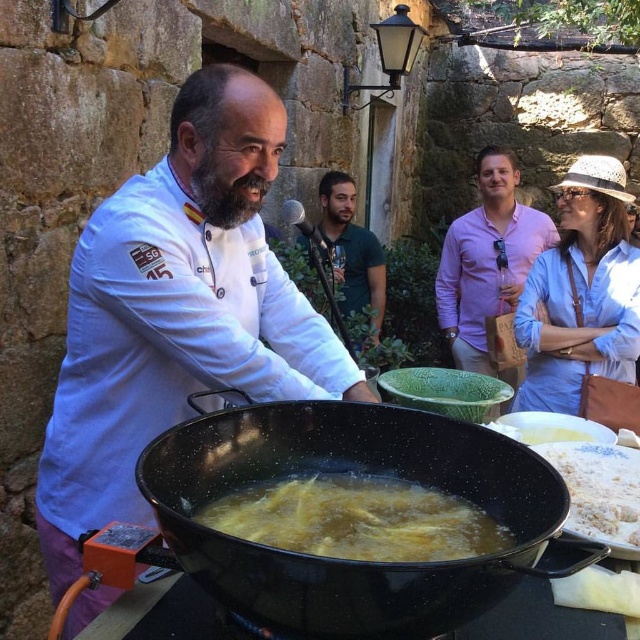
You are a photographer positioned at the front of the demonstration area. You need to take a photo that includes both the pink cotton shirt at upper center and the white flour at lower right. Which object will appear closer to the camera in the photo?

The pink cotton shirt at upper center will appear closer to the camera in the photo because it is further to the viewer than the white flour at lower right.

You are a photographer at the cooking event and need to capture both the pink cotton shirt at upper center and the white flour at lower right in a single shot. Given that your camera has a fixed focal length, which object should you focus on first to ensure both are in frame?

The pink cotton shirt at upper center is larger in size than the white flour at lower right, so focusing on the pink cotton shirt at upper center first will help ensure both are in frame as the larger object takes up more space in the composition.